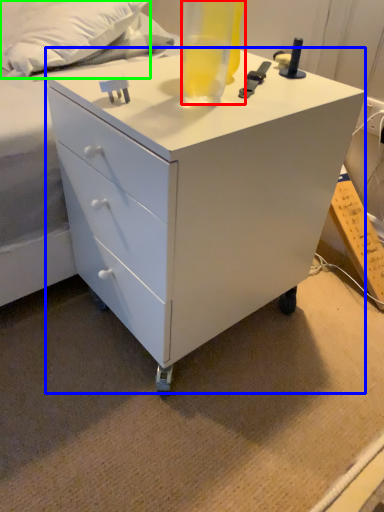
Question: Which is nearer to the beverage (highlighted by a red box)? chest of drawers (highlighted by a blue box) or pillow (highlighted by a green box).

Choices:
 (A) chest of drawers
 (B) pillow

Answer: (A)